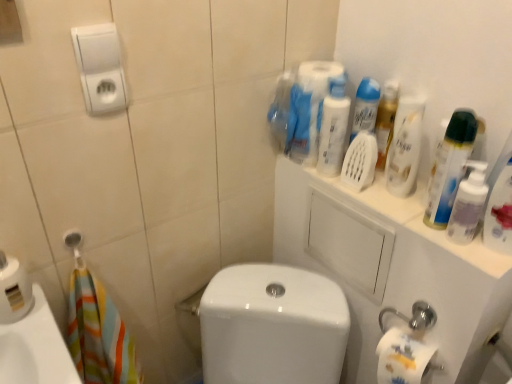
Find the location of `empty space that is ontop of white glossy porcelain at center, arranged as the first porcelain when viewed from the left (from a real-world perspective)`. empty space that is ontop of white glossy porcelain at center, arranged as the first porcelain when viewed from the left (from a real-world perspective) is located at coordinates (274, 294).